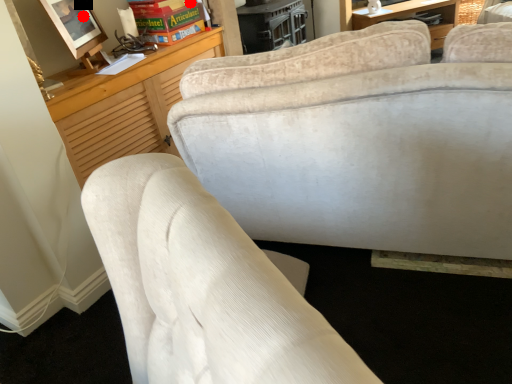
Question: Two points are circled on the image, labeled by A and B beside each circle. Which point is further to the camera?

Choices:
 (A) A is further
 (B) B is further

Answer: (B)